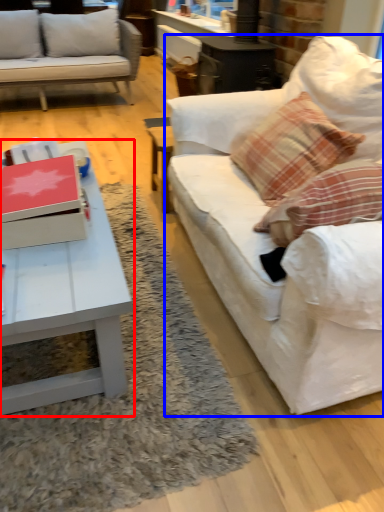
Question: Which point is closer to the camera, coffee table (highlighted by a red box) or studio couch (highlighted by a blue box)?

Choices:
 (A) coffee table
 (B) studio couch

Answer: (B)